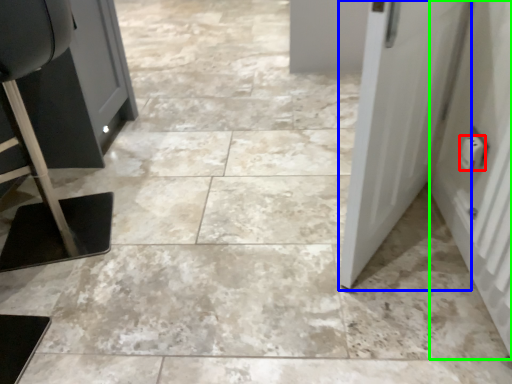
Question: Which object is the farthest from electric outlet (highlighted by a red box)? Choose among these: door (highlighted by a blue box) or door (highlighted by a green box).

Choices:
 (A) door
 (B) door

Answer: (A)